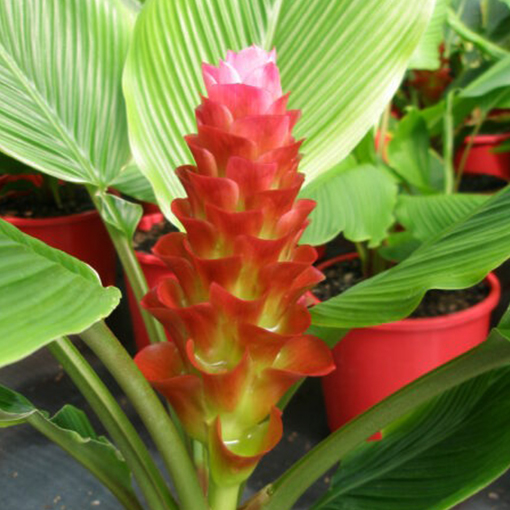
At what (x,y) coordinates should I click in order to perform the action: click on 1 dark colored surfaces. Please return your answer as a coordinate pair (x, y). Looking at the image, I should click on (39, 482).